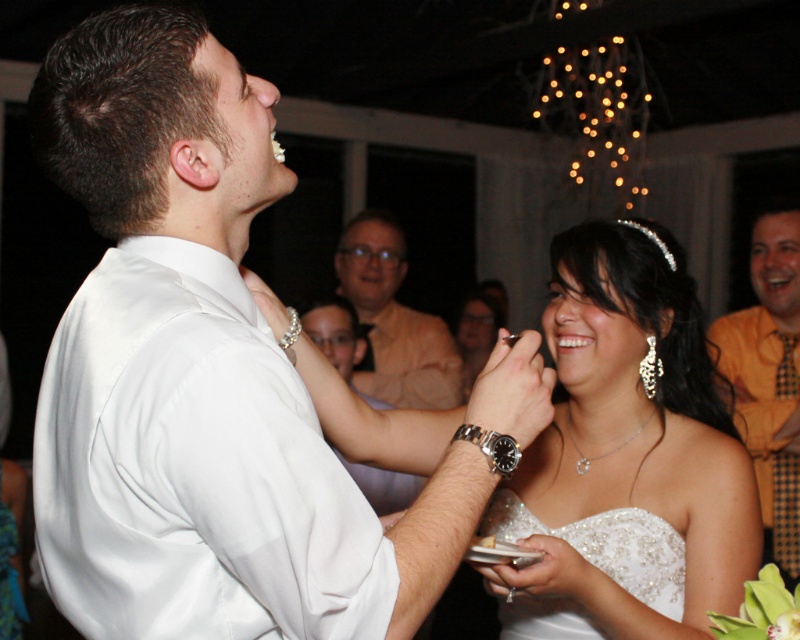
You are a photographer at the wedding reception. You need to capture a photo of the white satin dress at center and the matte beige shirt at center. Which one is located lower in the image?

The white satin dress at center is positioned under the matte beige shirt at center, so it is located lower in the image.